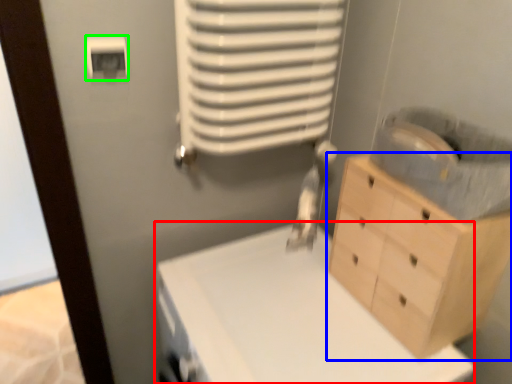
Question: Estimate the real-world distances between objects in this image. Which object is farther from changing table (highlighted by a red box), chest of drawers (highlighted by a blue box) or light switch (highlighted by a green box)?

Choices:
 (A) chest of drawers
 (B) light switch

Answer: (B)